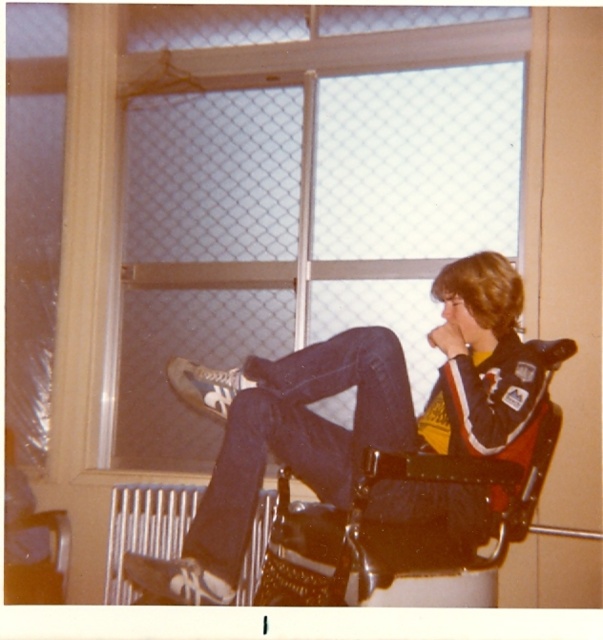
Is point (311, 440) positioned in front of point (212, 508)?

No, (311, 440) is further to viewer.

Is denim jeans at center bigger than dark blue denim jeans at center?

Indeed, denim jeans at center has a larger size compared to dark blue denim jeans at center.

Which is in front, point (472, 371) or point (238, 556)?

Point (238, 556) is more forward.

Identify the location of denim jeans at center. tap(353, 417).

Between clear glass window at upper center and dark blue denim jeans at center, which one appears on the left side from the viewer's perspective?

Positioned to the left is clear glass window at upper center.

Where is `clear glass window at upper center`? clear glass window at upper center is located at coordinates (308, 205).

Between clear glass window at upper center and denim jeans at center, which one is positioned lower?

denim jeans at center

Is clear glass window at upper center closer to camera compared to denim jeans at center?

No, it is not.

Which is behind, point (244, 237) or point (467, 381)?

The point (244, 237) is behind.

Locate an element on the screen. Image resolution: width=603 pixels, height=640 pixels. clear glass window at upper center is located at coordinates (308, 205).